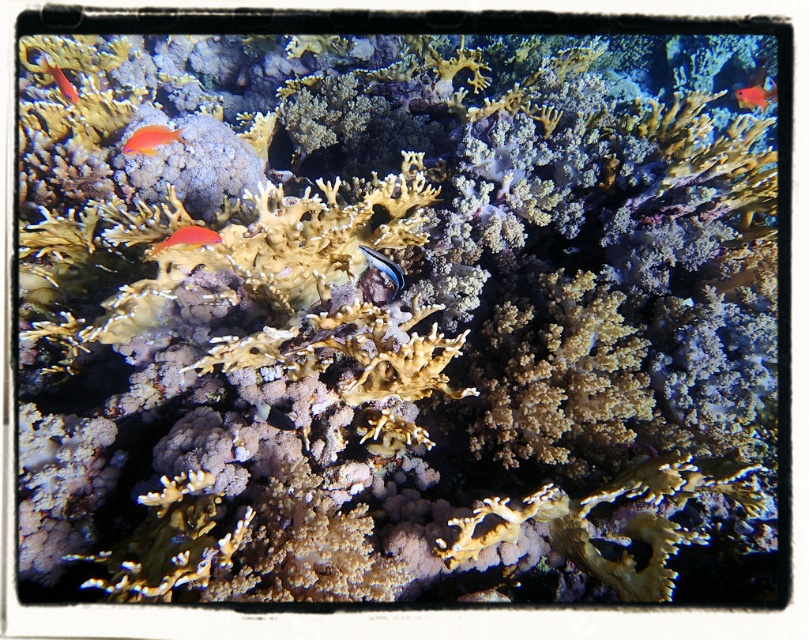
Question: Which point is closer to the camera?

Choices:
 (A) (380, 262)
 (B) (176, 243)
 (C) (133, 132)
 (D) (759, 106)

Answer: (B)

Question: Where is bright orange coral at upper left located in relation to blue glossy fish at center in the image?

Choices:
 (A) right
 (B) left

Answer: (B)

Question: Is bright orange coral at upper left positioned at the back of shiny red fish at upper right?

Choices:
 (A) no
 (B) yes

Answer: (A)

Question: Is shiny orange fish at left thinner than blue glossy fish at center?

Choices:
 (A) no
 (B) yes

Answer: (A)

Question: Which object appears closest to the camera in this image?

Choices:
 (A) shiny red fish at upper right
 (B) shiny orange fish at left

Answer: (B)

Question: Among these objects, which one is nearest to the camera?

Choices:
 (A) bright orange coral at upper left
 (B) blue glossy fish at center

Answer: (B)